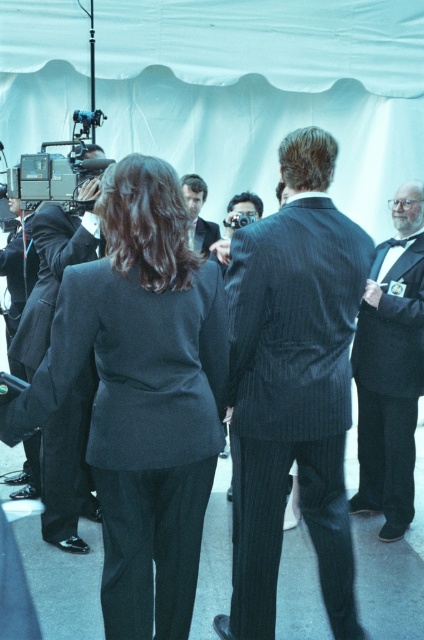
Question: Does matte black tuxedo at right have a smaller size compared to matte black video camera at left?

Choices:
 (A) no
 (B) yes

Answer: (B)

Question: Is matte black tuxedo at right to the left of matte black suit at left from the viewer's perspective?

Choices:
 (A) yes
 (B) no

Answer: (B)

Question: Among these points, which one is nearest to the camera?

Choices:
 (A) (89, 154)
 (B) (217, 237)
 (C) (357, 493)

Answer: (A)

Question: Which object appears farthest from the camera in this image?

Choices:
 (A) dark gray pinstripe suit at center
 (B) matte black suit at left
 (C) matte black tuxedo at right
 (D) matte black video camera at left

Answer: (A)

Question: Which point is closer to the camera taking this photo?

Choices:
 (A) (58, 202)
 (B) (331, 593)

Answer: (B)

Question: Does dark pinstripe suit at center appear over matte black tuxedo at right?

Choices:
 (A) yes
 (B) no

Answer: (B)